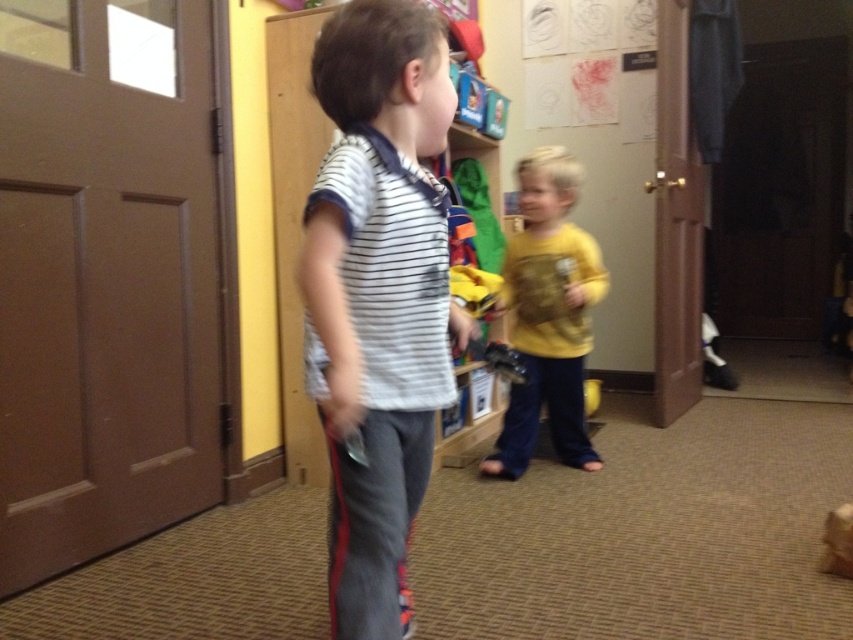
You are a teacher in the classroom and need to determine which child is wearing a narrower shirt between the white striped shirt at center and the yellow matte shirt at center. Which one should you point out?

The white striped shirt at center has a lesser width compared to the yellow matte shirt at center, so the child wearing the white striped shirt at center has the narrower shirt.

You are a teacher observing two children in the classroom. You notice the white striped shirt at center and the yellow matte shirt at center. Which child is shorter?

The white striped shirt at center is shorter than the yellow matte shirt at center, so the child wearing the white striped shirt at center is shorter.